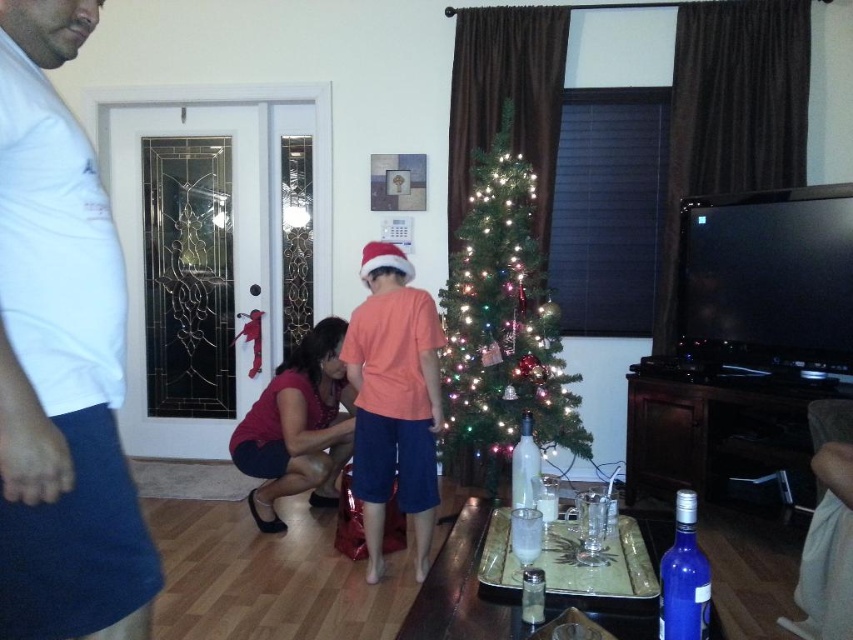
You are standing in the living room and want to place a new decoration 10 feet away from the Christmas tree. If the green matte christmas tree at center is currently 11.22 feet away from you, can you place the decoration in front of the tree while maintaining the required distance?

The green matte christmas tree at center is 11.22 feet away from the viewer. To place the decoration 10 feet away from the tree, you would need to move 1.22 feet closer to the tree. This would position the decoration in front of the tree while maintaining the required 10 feet distance between the decoration and the tree.